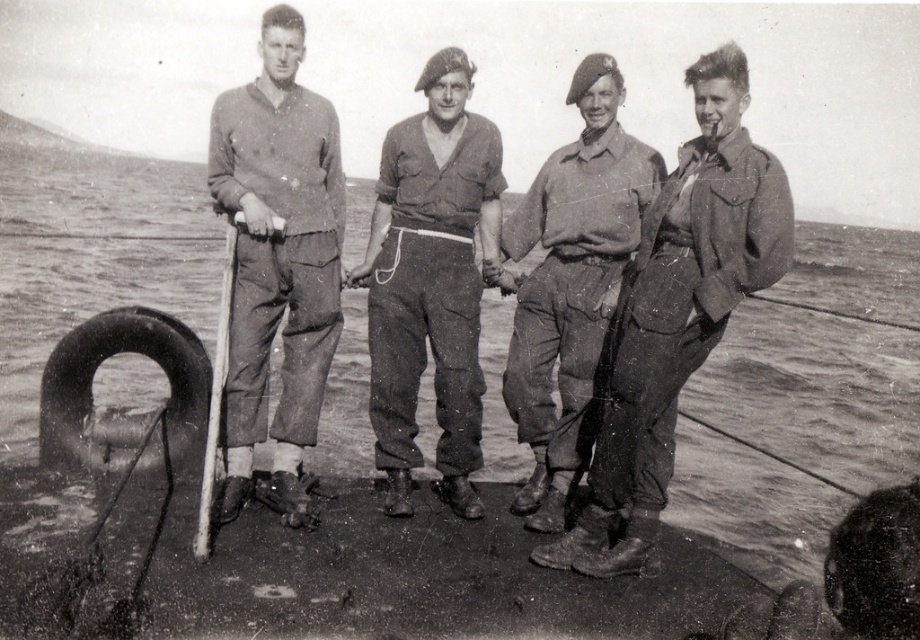
Is matte khaki beret at center taller than black rubber tire at lower left?

Yes.

Is matte khaki beret at center bigger than black rubber tire at lower left?

Indeed, matte khaki beret at center has a larger size compared to black rubber tire at lower left.

Is point (553, 449) behind point (128, 417)?

No, (553, 449) is closer to viewer.

This screenshot has width=920, height=640. I want to click on matte khaki beret at center, so click(571, 284).

Can you confirm if matte khaki jacket at right is smaller than matte khaki pants at left?

Actually, matte khaki jacket at right might be larger than matte khaki pants at left.

Is matte khaki jacket at right wider than matte khaki pants at left?

Correct, the width of matte khaki jacket at right exceeds that of matte khaki pants at left.

The image size is (920, 640). I want to click on matte khaki jacket at right, so click(677, 314).

Who is shorter, matte khaki pants at left or matte khaki pants at center?

matte khaki pants at center

Where is `matte khaki pants at left`? The image size is (920, 640). matte khaki pants at left is located at coordinates (277, 262).